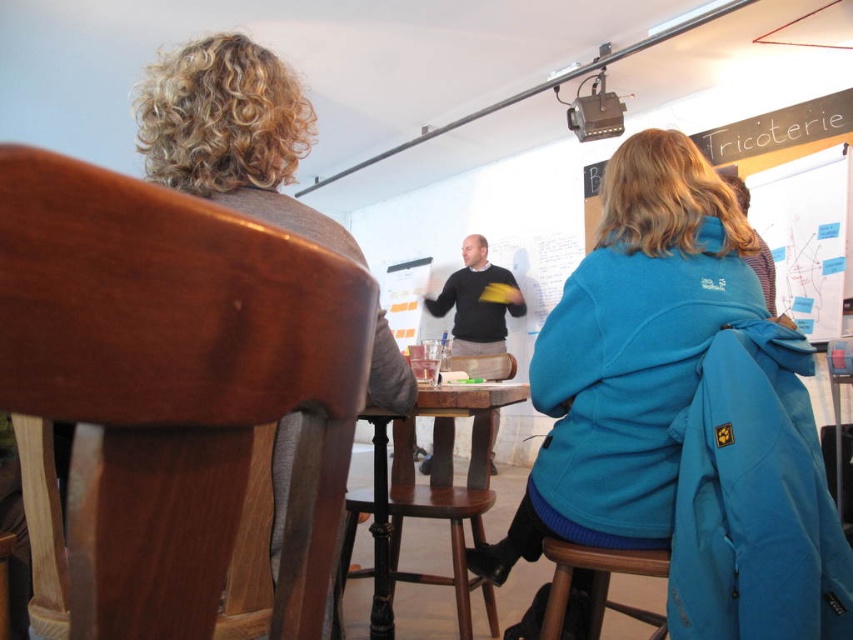
Question: Does black matte sweater at center appear on the right side of wooden bar stool at lower right?

Choices:
 (A) yes
 (B) no

Answer: (B)

Question: Which object appears closest to the camera in this image?

Choices:
 (A) brown leather chair at left
 (B) black matte sweater at center

Answer: (A)

Question: Estimate the real-world distances between objects in this image. Which object is farther from the blue fleece jacket at center?

Choices:
 (A) brown leather chair at left
 (B) wooden table at center

Answer: (A)

Question: Observing the image, what is the correct spatial positioning of blue fleece jacket at center in reference to black matte sweater at center?

Choices:
 (A) above
 (B) below

Answer: (B)

Question: Does brown leather chair at left have a smaller size compared to wooden bar stool at lower right?

Choices:
 (A) yes
 (B) no

Answer: (B)

Question: Considering the real-world distances, which object is farthest from the blue fleece jacket at center?

Choices:
 (A) black matte sweater at center
 (B) wooden bar stool at lower right

Answer: (A)